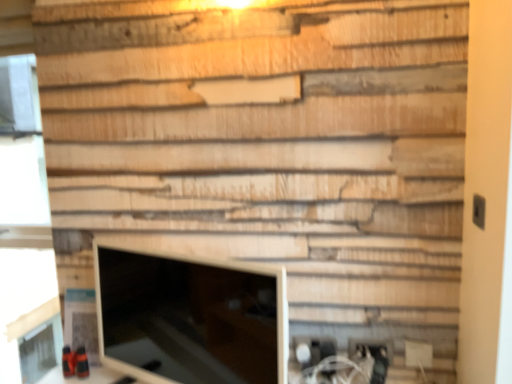
This screenshot has height=384, width=512. What do you see at coordinates (190, 318) in the screenshot?
I see `matte white monitor at center` at bounding box center [190, 318].

Where is `matte white monitor at center`? Image resolution: width=512 pixels, height=384 pixels. matte white monitor at center is located at coordinates (190, 318).

This screenshot has width=512, height=384. I want to click on matte white monitor at center, so click(190, 318).